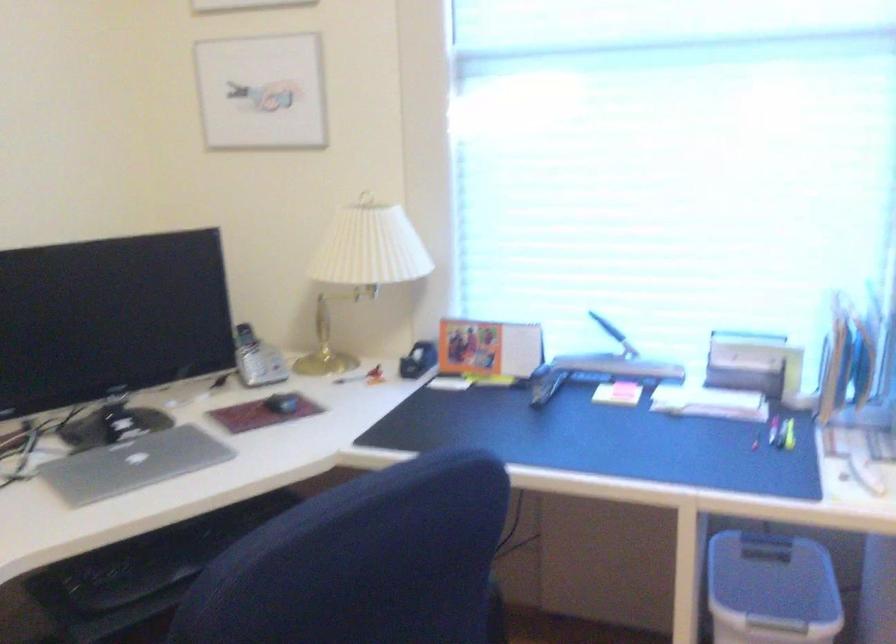
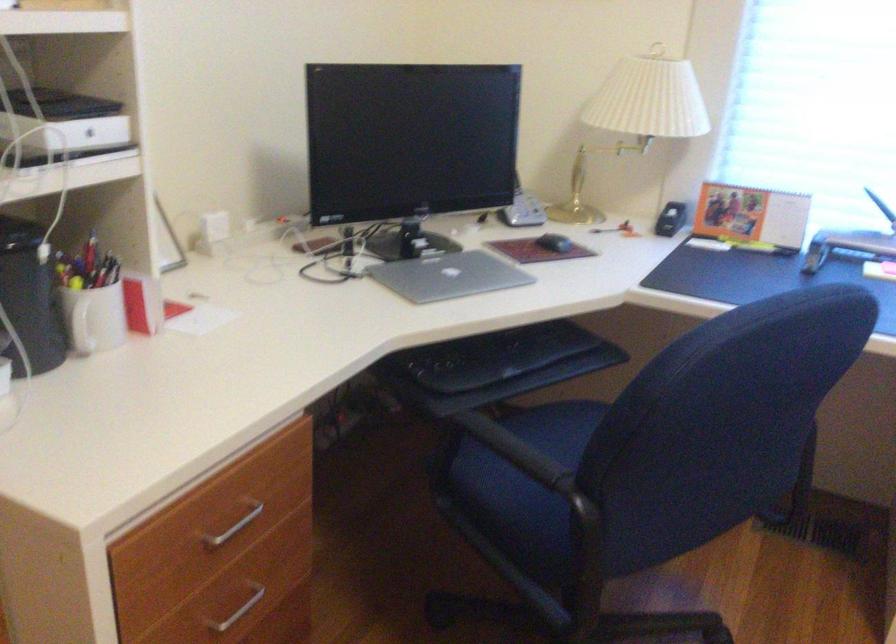
Where in the second image is the point corresponding to (x=582, y=373) from the first image?

(847, 245)